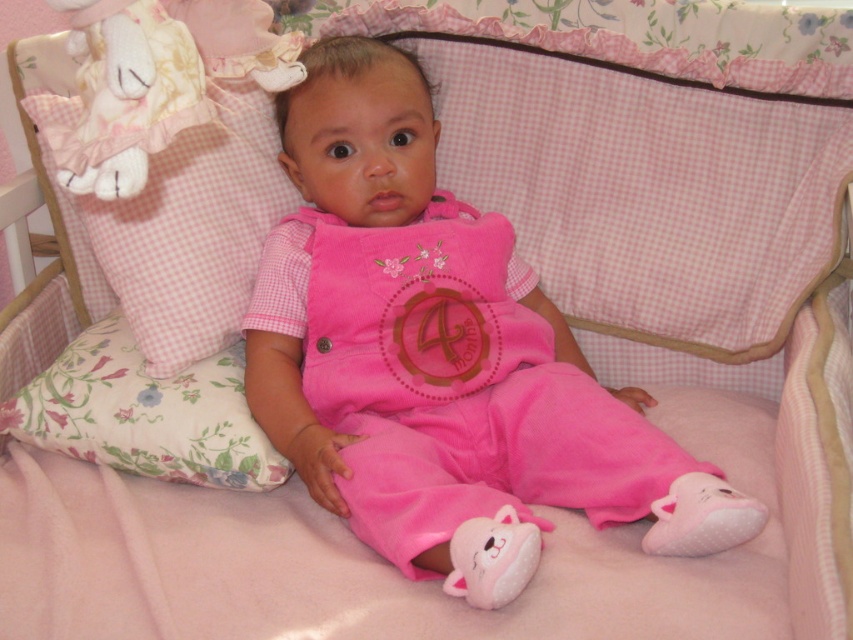
Question: Can you confirm if floral fabric pillow at lower left is bigger than fluffy fabric stuffed animal at upper left?

Choices:
 (A) yes
 (B) no

Answer: (B)

Question: Which point appears closest to the camera in this image?

Choices:
 (A) (83, 445)
 (B) (389, 324)
 (C) (492, 572)

Answer: (C)

Question: Which object is farther from the camera taking this photo?

Choices:
 (A) floral fabric pillow at lower left
 (B) pink plush cat at lower center
 (C) fluffy fabric stuffed animal at upper left
 (D) pink velvety onesie at center

Answer: (A)

Question: Is pink velvety onesie at center in front of fluffy fabric stuffed animal at upper left?

Choices:
 (A) yes
 (B) no

Answer: (B)

Question: Is pink velvety onesie at center below pink gingham pillow at upper left?

Choices:
 (A) no
 (B) yes

Answer: (B)

Question: Which of these objects is positioned farthest from the pink velvety onesie at center?

Choices:
 (A) floral fabric pillow at lower left
 (B) pink gingham pillow at upper left
 (C) pink plush cat at lower center
 (D) fluffy fabric stuffed animal at upper left

Answer: (D)